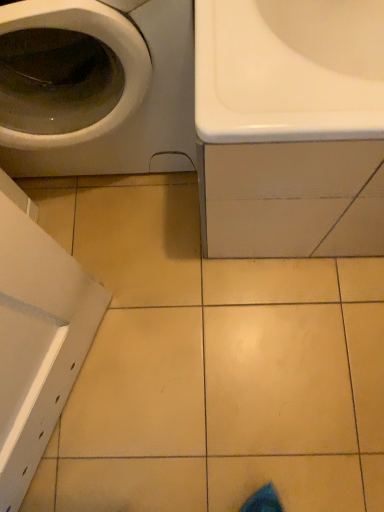
Question: Can you confirm if white glossy sink at upper right is shorter than white glossy washing machine at upper left?

Choices:
 (A) yes
 (B) no

Answer: (A)

Question: Can you confirm if white glossy sink at upper right is taller than white glossy washing machine at upper left?

Choices:
 (A) yes
 (B) no

Answer: (B)

Question: Is white glossy sink at upper right located outside white glossy washing machine at upper left?

Choices:
 (A) yes
 (B) no

Answer: (A)

Question: Does white glossy sink at upper right have a larger size compared to white glossy washing machine at upper left?

Choices:
 (A) no
 (B) yes

Answer: (B)

Question: Does white glossy sink at upper right lie behind white glossy washing machine at upper left?

Choices:
 (A) yes
 (B) no

Answer: (A)

Question: Can you confirm if white glossy sink at upper right is smaller than white glossy washing machine at upper left?

Choices:
 (A) no
 (B) yes

Answer: (A)

Question: Is white glossy washing machine at upper left taller than white glossy sink at upper right?

Choices:
 (A) no
 (B) yes

Answer: (B)

Question: From a real-world perspective, is white glossy washing machine at upper left under white glossy sink at upper right?

Choices:
 (A) no
 (B) yes

Answer: (A)

Question: From the image's perspective, is white glossy washing machine at upper left located beneath white glossy sink at upper right?

Choices:
 (A) yes
 (B) no

Answer: (B)

Question: Are white glossy washing machine at upper left and white glossy sink at upper right making contact?

Choices:
 (A) yes
 (B) no

Answer: (B)

Question: Can you confirm if white glossy washing machine at upper left is positioned to the left of white glossy sink at upper right?

Choices:
 (A) yes
 (B) no

Answer: (A)

Question: From a real-world perspective, does white glossy washing machine at upper left stand above white glossy sink at upper right?

Choices:
 (A) yes
 (B) no

Answer: (A)

Question: Looking at their shapes, would you say white glossy sink at upper right is wider or thinner than white glossy washing machine at upper left?

Choices:
 (A) thin
 (B) wide

Answer: (B)